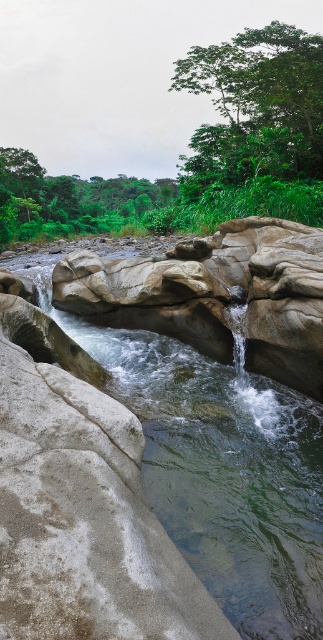
You are standing at the center of the rocky riverbed and see the green leafy tree at upper right and the green leafy tree at upper left. Which tree is located to the right of the other?

The green leafy tree at upper right is positioned on the right side of the green leafy tree at upper left.

You are standing at the center of the rocky riverbed and want to walk towards the green leafy tree at upper right and the green leafy tree at upper left. Which tree should you head toward if you want to reach the one that is closer to you first?

You should head toward the green leafy tree at upper right first because it is closer to you than the green leafy tree at upper left.

You are a hiker standing at the center of the rocky riverbed. You notice two green leafy trees in the background. How far apart are the green leafy tree at upper right and the green leafy tree at upper left?

The distance between the green leafy tree at upper right and the green leafy tree at upper left is 24.54 meters.